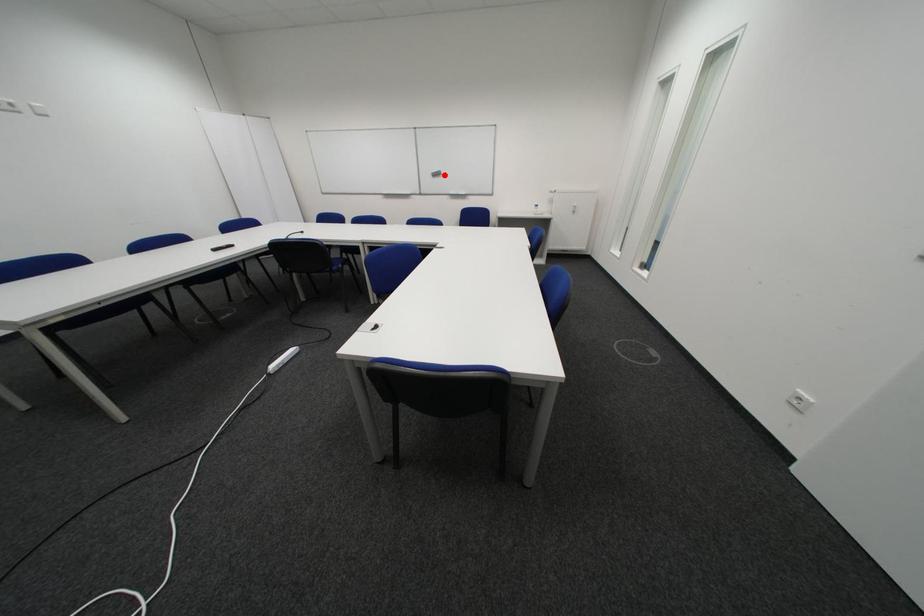
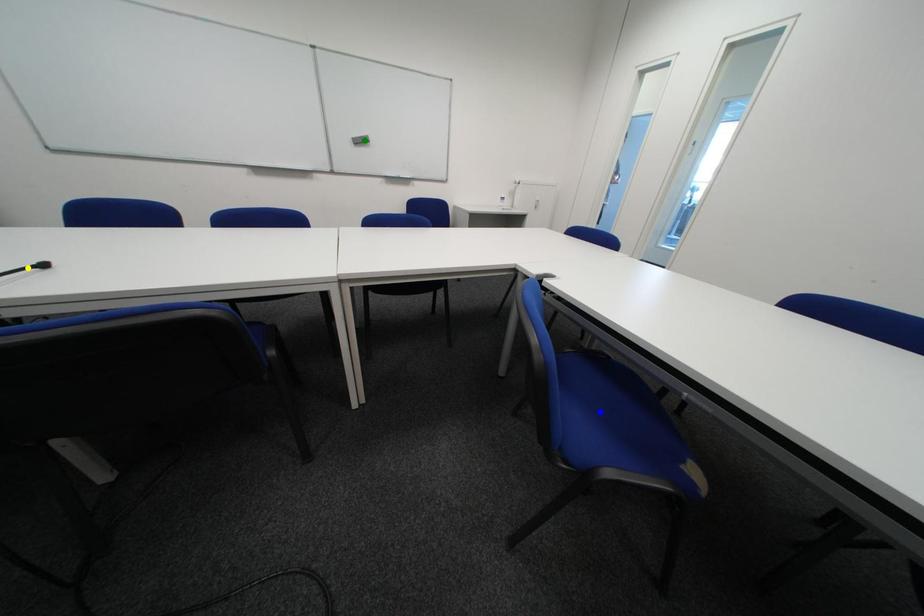
Question: I am providing you with two images of the same scene from different viewpoints. A red point is marked on the first image. You are given multiple points on the second image. Which mark in image 2 goes with the point in image 1?

Choices:
 (A) blue point
 (B) green point
 (C) yellow point

Answer: (B)